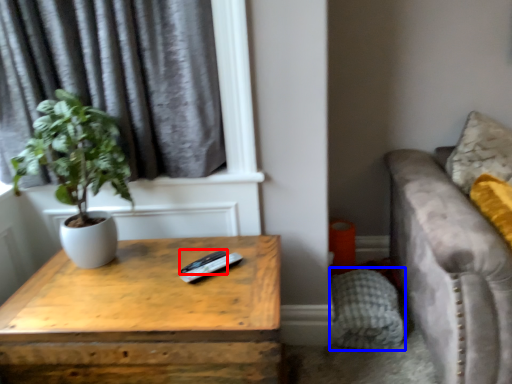
Question: Which point is closer to the camera, remote (highlighted by a red box) or pillow (highlighted by a blue box)?

Choices:
 (A) remote
 (B) pillow

Answer: (A)